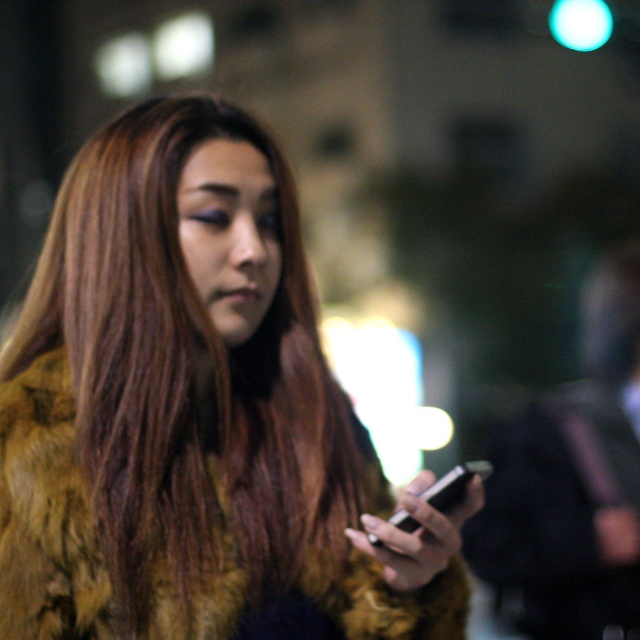
Does fur coat at center appear on the right side of black glossy smartphone at lower center?

In fact, fur coat at center is to the left of black glossy smartphone at lower center.

Find the location of a particular element. This screenshot has height=640, width=640. fur coat at center is located at coordinates (195, 413).

The width and height of the screenshot is (640, 640). I want to click on fur coat at center, so click(x=195, y=413).